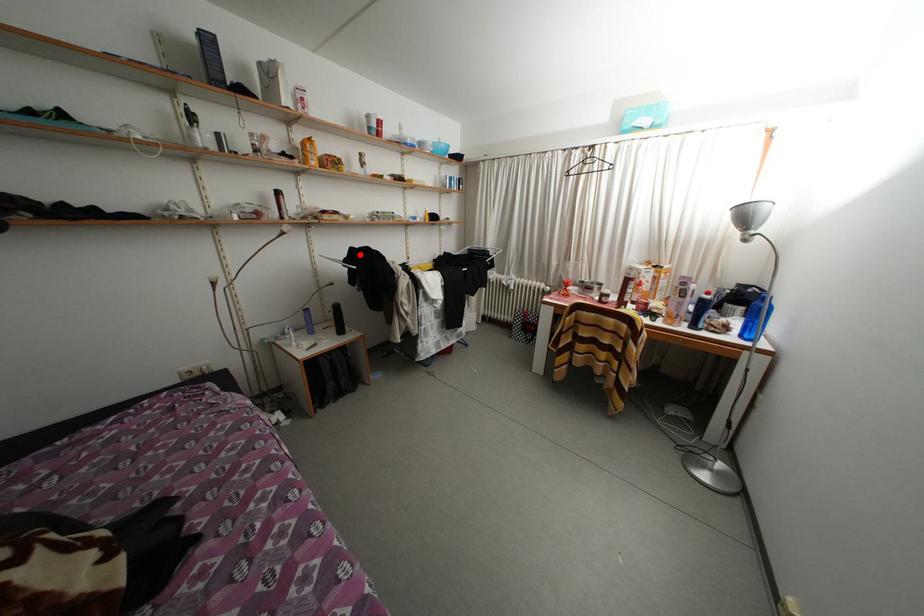
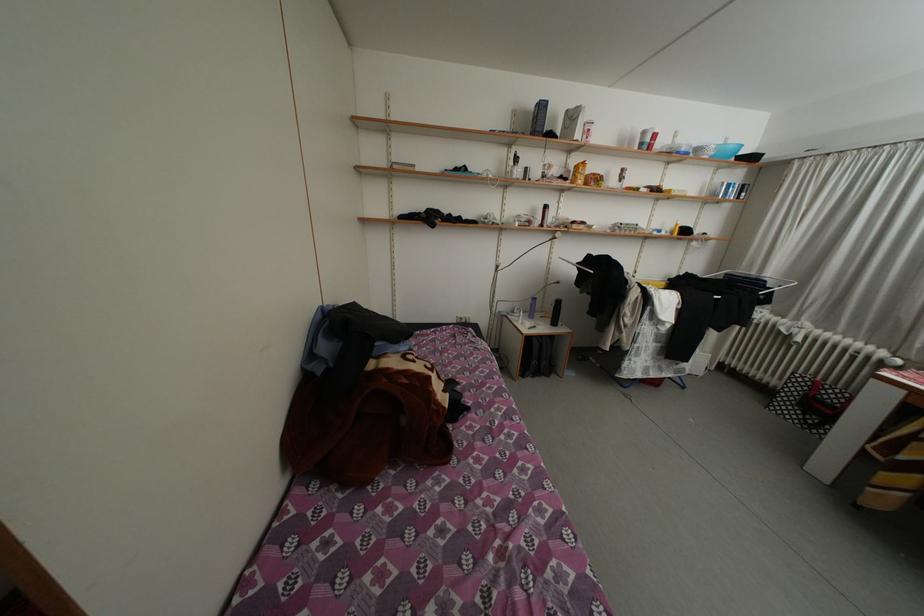
Question: A red point is marked in image1. In image2, is the corresponding 3D point closer to the camera or farther? Reply with the corresponding letter.

Choices:
 (A) The corresponding 3D point is closer.
 (B) The corresponding 3D point is farther.

Answer: (A)